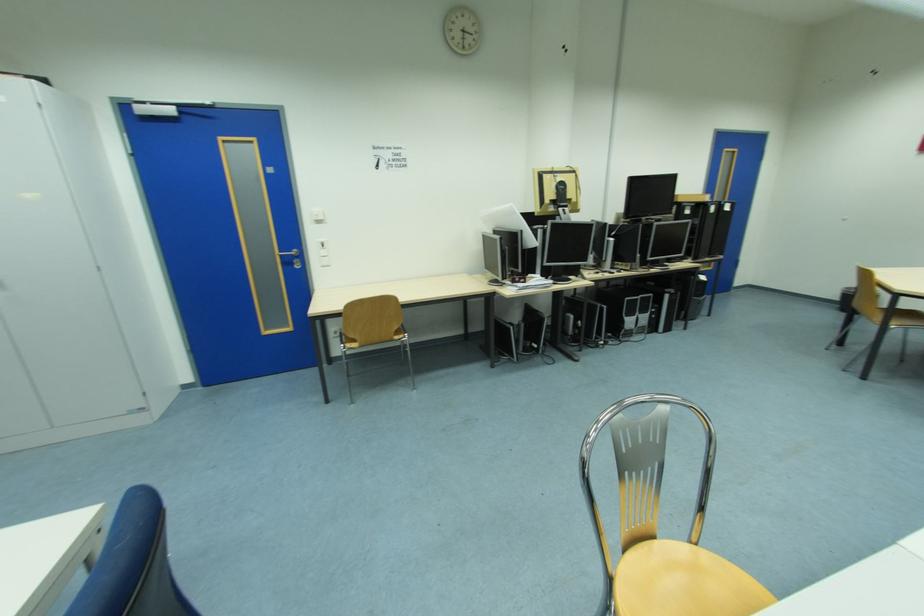
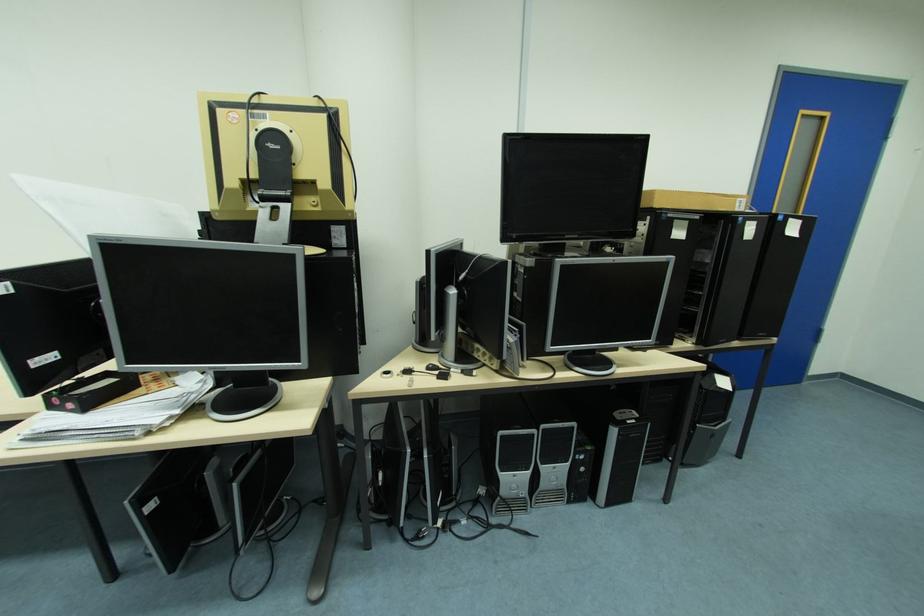
Locate, in the second image, the point that corresponds to point (686, 201) in the first image.

(664, 206)